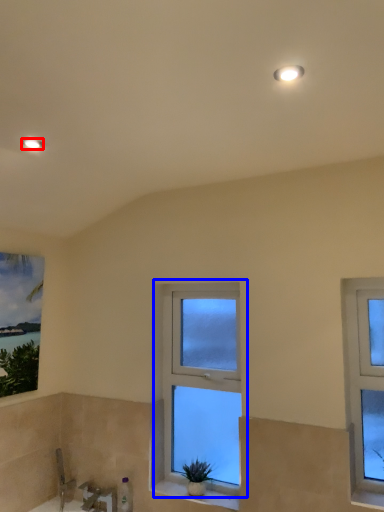
Question: Which object appears closest to the camera in this image, light fixture (highlighted by a red box) or window (highlighted by a blue box)?

Choices:
 (A) light fixture
 (B) window

Answer: (A)